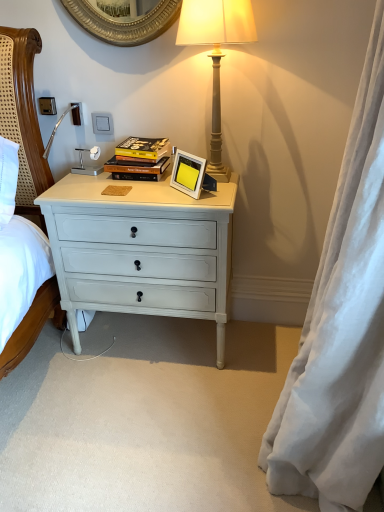
Find the location of a particular element. free spot to the right of wooden picture frame at center is located at coordinates (219, 189).